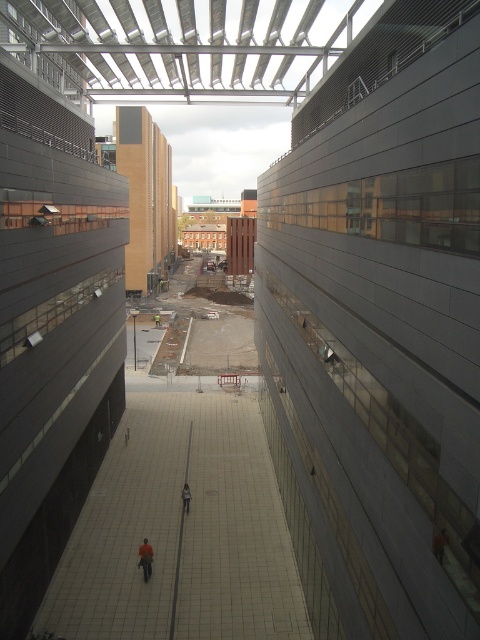
Question: Considering the real-world distances, which object is farthest from the white tile floor at center?

Choices:
 (A) orange fabric person at center
 (B) orange fabric person at lower right
 (C) dark gray jacket at center

Answer: (B)

Question: Can you confirm if orange fabric person at center is bigger than orange fabric person at lower right?

Choices:
 (A) no
 (B) yes

Answer: (B)

Question: Which object is farther from the camera taking this photo?

Choices:
 (A) dark gray jacket at center
 (B) orange fabric person at lower right

Answer: (A)

Question: Where is white tile floor at center located in relation to dark gray jacket at center in the image?

Choices:
 (A) right
 (B) left

Answer: (B)

Question: Does white tile floor at center have a lesser width compared to orange fabric person at lower right?

Choices:
 (A) no
 (B) yes

Answer: (A)

Question: Which object is positioned closest to the white tile floor at center?

Choices:
 (A) orange fabric person at center
 (B) dark gray jacket at center

Answer: (B)